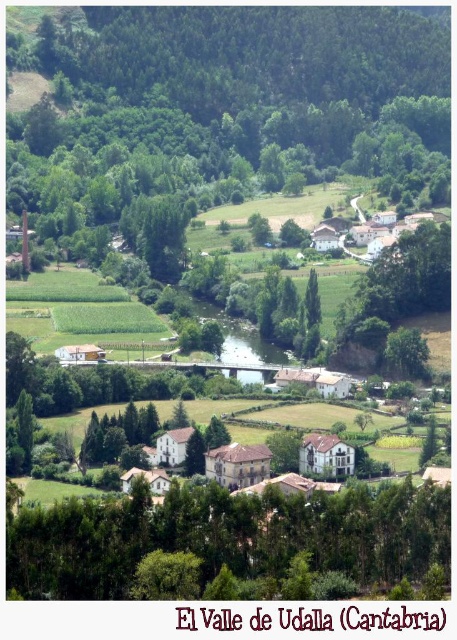
You are a hiker standing in the valley and want to take a photo of the brown stone houses at center. However, the green leafy trees at lower center are blocking your view. Can you determine if the trees are taller than the houses?

The green leafy trees at lower center are taller than the brown stone houses at center, so they are blocking your view.

You are planning to plant a new tree in the valley. You have two options based on the existing trees in the image. Which of the two trees, the green leafy trees at lower center or the green leafy tree at center, would require more space horizontally if you want to maintain the current spacing between them and nearby structures?

The green leafy trees at lower center might require more space horizontally since they are wider than the green leafy tree at center.

You are a hiker standing at the edge of the valley in El Valle de Udalla, Cantabria. You see the green leafy trees at lower center and the brown stone houses at center. How far apart are these two landmarks?

The green leafy trees at lower center and brown stone houses at center are 137.30 feet apart.